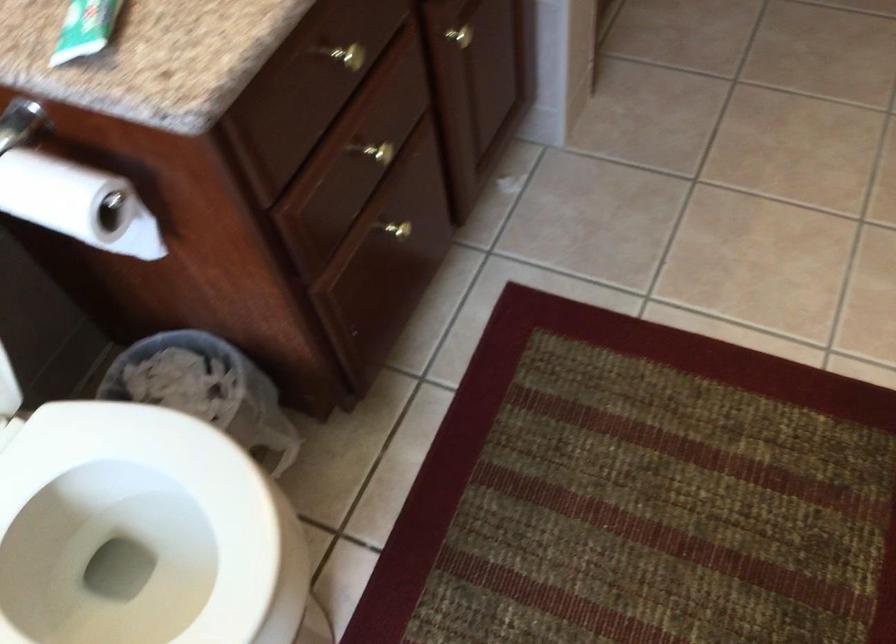
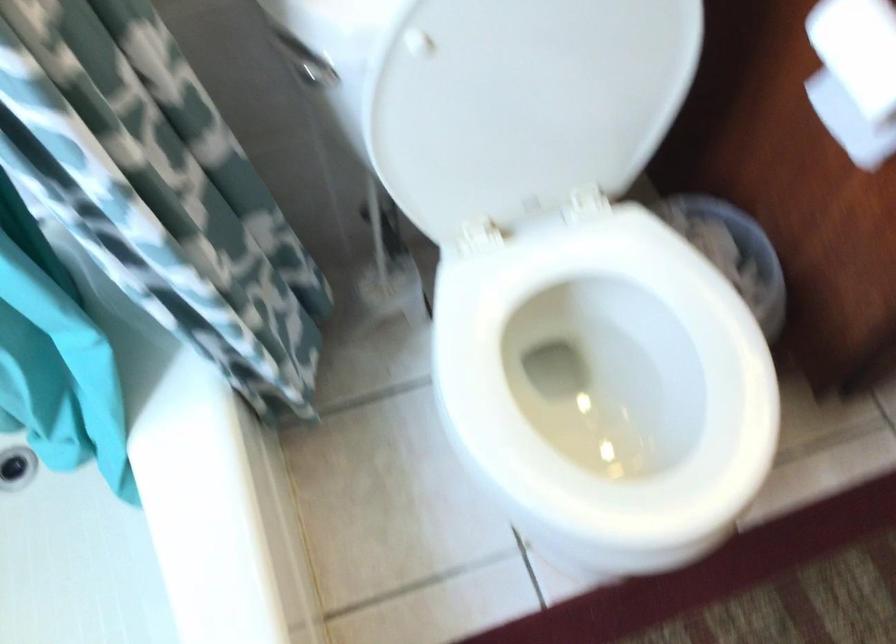
Where in the second image is the point corresponding to pixel 161 544 from the first image?

(606, 375)